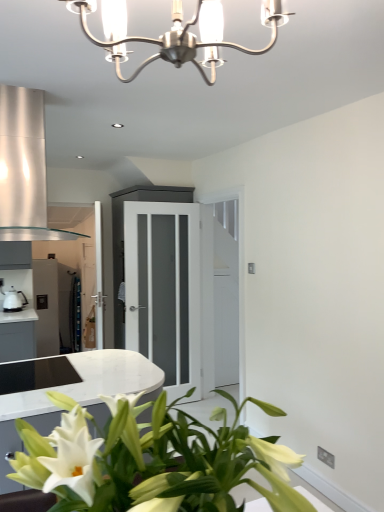
Question: Does white glossy houseplant at lower left have a greater height compared to brushed metal chandelier at upper center?

Choices:
 (A) no
 (B) yes

Answer: (B)

Question: Does white glossy houseplant at lower left turn towards brushed metal chandelier at upper center?

Choices:
 (A) yes
 (B) no

Answer: (B)

Question: Is white glossy houseplant at lower left surrounding brushed metal chandelier at upper center?

Choices:
 (A) yes
 (B) no

Answer: (B)

Question: Considering the relative positions of white glossy houseplant at lower left and brushed metal chandelier at upper center in the image provided, is white glossy houseplant at lower left to the right of brushed metal chandelier at upper center from the viewer's perspective?

Choices:
 (A) yes
 (B) no

Answer: (A)

Question: Is white glossy houseplant at lower left at the left side of brushed metal chandelier at upper center?

Choices:
 (A) no
 (B) yes

Answer: (A)

Question: Looking at their shapes, would you say brushed metal chandelier at upper center is wider or thinner than satin silver exhaust hood at upper left?

Choices:
 (A) wide
 (B) thin

Answer: (B)

Question: Considering the relative positions of brushed metal chandelier at upper center and satin silver exhaust hood at upper left in the image provided, is brushed metal chandelier at upper center to the left or to the right of satin silver exhaust hood at upper left?

Choices:
 (A) left
 (B) right

Answer: (B)

Question: Looking at the image, does brushed metal chandelier at upper center seem bigger or smaller compared to satin silver exhaust hood at upper left?

Choices:
 (A) small
 (B) big

Answer: (A)

Question: From a real-world perspective, is brushed metal chandelier at upper center above or below satin silver exhaust hood at upper left?

Choices:
 (A) below
 (B) above

Answer: (B)

Question: Is satin silver exhaust hood at upper left taller or shorter than white frosted glass door at center?

Choices:
 (A) tall
 (B) short

Answer: (B)

Question: From the image's perspective, is satin silver exhaust hood at upper left located above or below white frosted glass door at center?

Choices:
 (A) below
 (B) above

Answer: (B)

Question: Relative to white frosted glass door at center, is satin silver exhaust hood at upper left in front or behind?

Choices:
 (A) front
 (B) behind

Answer: (A)

Question: Is satin silver exhaust hood at upper left to the left or to the right of white frosted glass door at center in the image?

Choices:
 (A) right
 (B) left

Answer: (B)

Question: Is point (41, 188) positioned closer to the camera than point (246, 471)?

Choices:
 (A) farther
 (B) closer

Answer: (A)

Question: Is satin silver exhaust hood at upper left taller or shorter than white glossy houseplant at lower left?

Choices:
 (A) short
 (B) tall

Answer: (B)